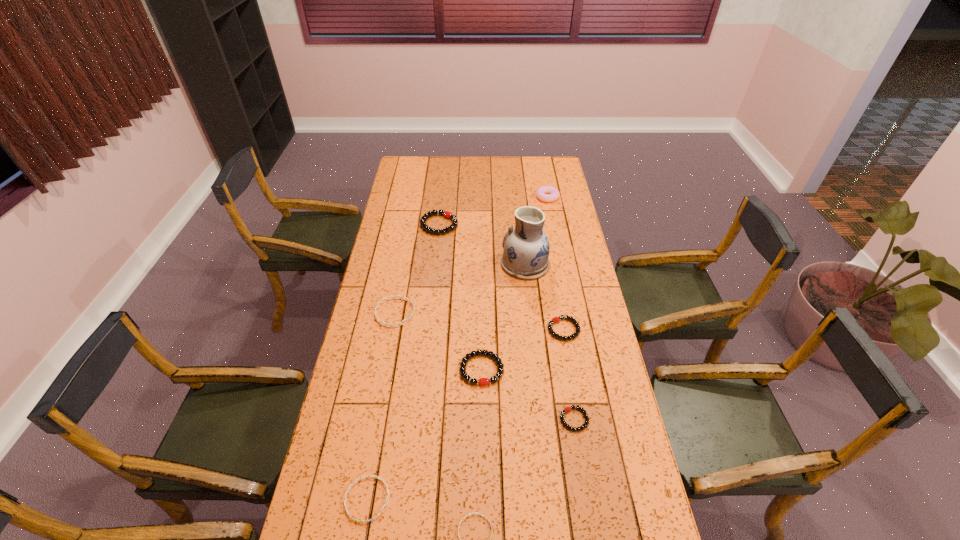
Locate an element on the screen. This screenshot has width=960, height=540. pottery at the right edge is located at coordinates (526, 247).

This screenshot has height=540, width=960. What are the coordinates of `doughnut at the right edge` in the screenshot? It's located at (545, 193).

I want to click on vacant region at the far edge of the desktop, so click(489, 172).

Identify the location of free space at the left edge. The image size is (960, 540). (376, 272).

The width and height of the screenshot is (960, 540). In the image, there is a desktop. Identify the location of free region at the right edge. (586, 374).

Identify the location of free space between the farthest object and the third nearest black bracelet. (555, 264).

This screenshot has width=960, height=540. In order to click on free space between the farthest object and the second biggest blue bracelet in this screenshot , I will do `click(457, 348)`.

Locate an element on the screen. free space between the biggest black bracelet and the nearest black bracelet is located at coordinates (507, 322).

In order to click on vacant space in between the third biggest black bracelet and the pottery in this screenshot , I will do `click(544, 296)`.

I want to click on free space between the nearest black bracelet and the farthest bracelet, so click(507, 322).